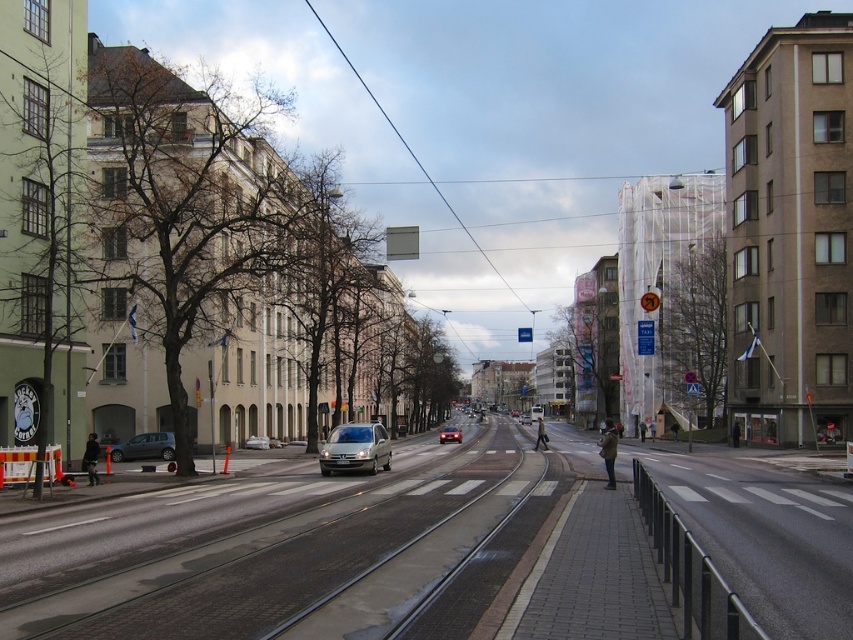
Question: Considering the real-world distances, which object is closest to the shiny silver sedan at center?

Choices:
 (A) matte gray car at left
 (B) silver metallic sedan at center

Answer: (B)

Question: Which point is closer to the camera?

Choices:
 (A) silver metallic sedan at center
 (B) shiny silver sedan at center
 (C) matte gray car at left
 (D) satin silver van at center

Answer: (D)

Question: Where is satin silver van at center located in relation to matte gray car at left in the image?

Choices:
 (A) below
 (B) above

Answer: (B)

Question: Can you confirm if satin silver van at center is wider than matte gray car at left?

Choices:
 (A) yes
 (B) no

Answer: (A)

Question: Which of the following is the farthest from the observer?

Choices:
 (A) (440, 440)
 (B) (161, 454)

Answer: (A)

Question: Does matte gray car at left appear under silver metallic sedan at center?

Choices:
 (A) no
 (B) yes

Answer: (A)